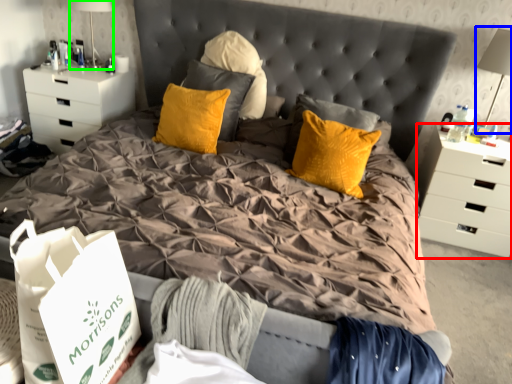
Question: Considering the real-world distances, which object is farthest from chest of drawers (highlighted by a red box)? table lamp (highlighted by a blue box) or table lamp (highlighted by a green box)?

Choices:
 (A) table lamp
 (B) table lamp

Answer: (B)